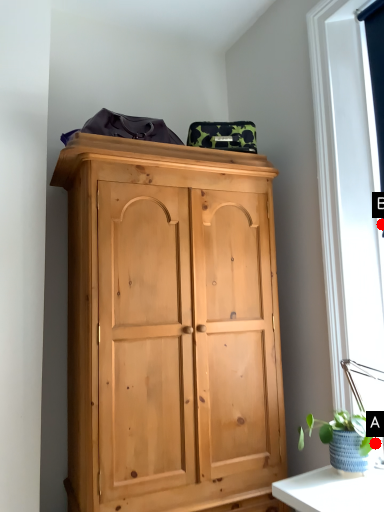
Question: Two points are circled on the image, labeled by A and B beside each circle. Which of the following is the closest to the observer?

Choices:
 (A) A is closer
 (B) B is closer

Answer: (A)